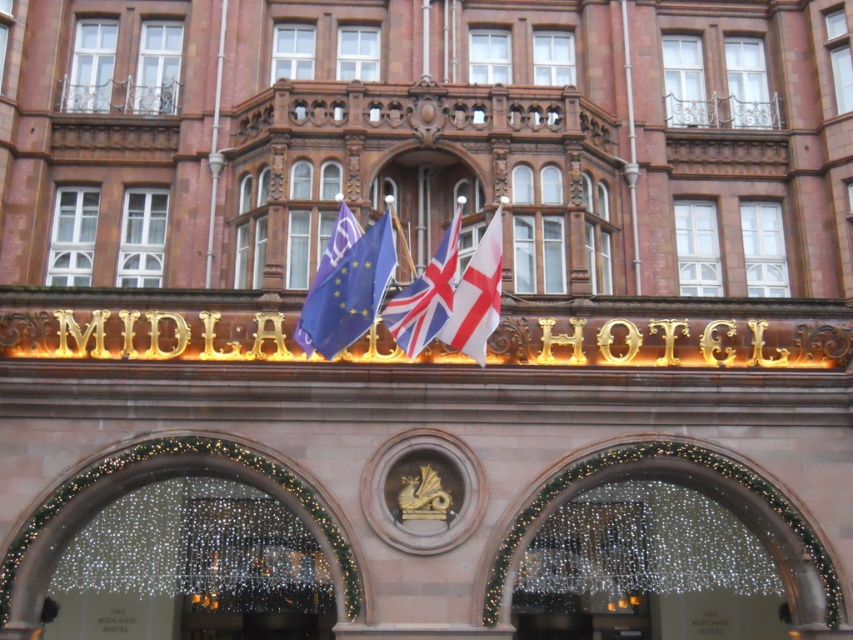
You are standing at the base of the Midland Hotel, looking up at the three flags displayed above the entrance. The flags include the European Union flag, the Union Jack, and a white fabric flag at center. Which flag is positioned exactly in the middle of the three flags?

The white fabric flag at center is positioned exactly in the middle of the three flags displayed above the entrance.

From the picture: You are standing in front of the Midland Hotel and notice two flags at the center above the entrance. The blue fabric flag at center and the white fabric flag at center. Which flag is closer to you?

The blue fabric flag at center is closer to you because the white fabric flag at center is behind it.